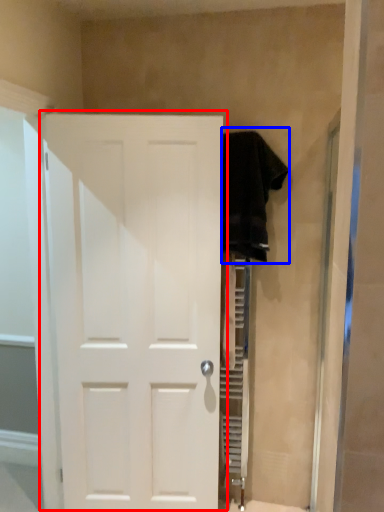
Question: Which point is further to the camera, door (highlighted by a red box) or clothing (highlighted by a blue box)?

Choices:
 (A) door
 (B) clothing

Answer: (B)